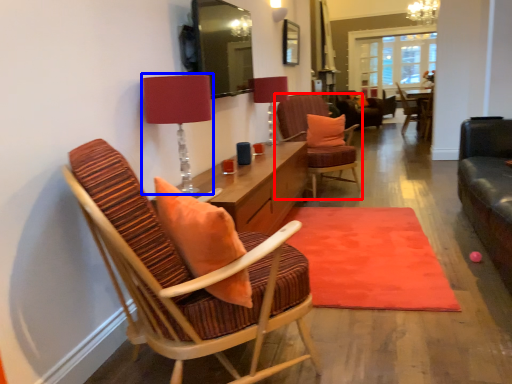
Question: Which object appears farthest to the camera in this image, chair (highlighted by a red box) or table lamp (highlighted by a blue box)?

Choices:
 (A) chair
 (B) table lamp

Answer: (A)